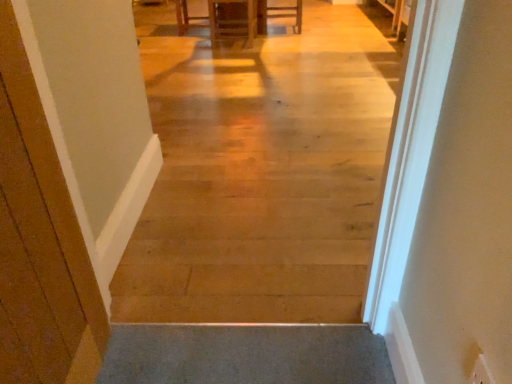
Question: Does matte wood cabinet at center, the first furniture positioned from the left, have a lesser width compared to matte wooden chair at center, marked as the 2th furniture in a left-to-right arrangement?

Choices:
 (A) no
 (B) yes

Answer: (A)

Question: Is matte wooden chair at center, positioned as the first furniture in right-to-left order, completely or partially inside matte wood cabinet at center, the first furniture in the front-to-back sequence?

Choices:
 (A) no
 (B) yes

Answer: (A)

Question: Considering the relative sizes of matte wood cabinet at center, the first furniture positioned from the left, and matte wooden chair at center, marked as the 2th furniture in a left-to-right arrangement, in the image provided, is matte wood cabinet at center, the first furniture positioned from the left, shorter than matte wooden chair at center, marked as the 2th furniture in a left-to-right arrangement,?

Choices:
 (A) no
 (B) yes

Answer: (A)

Question: From a real-world perspective, is matte wood cabinet at center, the 2th furniture from the back, beneath matte wooden chair at center, which is the 1th furniture from back to front?

Choices:
 (A) yes
 (B) no

Answer: (B)

Question: From a real-world perspective, does matte wood cabinet at center, the first furniture positioned from the left, stand above matte wooden chair at center, which is the 1th furniture from back to front?

Choices:
 (A) yes
 (B) no

Answer: (A)

Question: Is wooden table at center inside the boundaries of matte wooden chair at center, which is counted as the 2th furniture, starting from the front, or outside?

Choices:
 (A) inside
 (B) outside

Answer: (B)

Question: Is point (180, 18) positioned closer to the camera than point (297, 1)?

Choices:
 (A) farther
 (B) closer

Answer: (A)

Question: From a real-world perspective, is wooden table at center positioned above or below matte wooden chair at center, marked as the 2th furniture in a left-to-right arrangement?

Choices:
 (A) below
 (B) above

Answer: (B)

Question: Looking at their shapes, would you say wooden table at center is wider or thinner than matte wooden chair at center, which is the 1th furniture from back to front?

Choices:
 (A) thin
 (B) wide

Answer: (B)

Question: Is point (270, 187) closer or farther from the camera than point (279, 16)?

Choices:
 (A) closer
 (B) farther

Answer: (A)

Question: From their relative heights in the image, would you say wooden floor at center is taller or shorter than matte wooden chair at center, which is the 1th furniture from back to front?

Choices:
 (A) short
 (B) tall

Answer: (B)

Question: Based on their positions, is wooden floor at center located to the left or right of matte wooden chair at center, marked as the 2th furniture in a left-to-right arrangement?

Choices:
 (A) left
 (B) right

Answer: (A)

Question: Based on their sizes in the image, would you say wooden floor at center is bigger or smaller than matte wooden chair at center, positioned as the first furniture in right-to-left order?

Choices:
 (A) big
 (B) small

Answer: (A)

Question: From a real-world perspective, is matte wooden chair at center, which is counted as the 2th furniture, starting from the front, physically located above or below wooden table at center?

Choices:
 (A) above
 (B) below

Answer: (B)

Question: Based on their positions, is matte wooden chair at center, which is counted as the 2th furniture, starting from the front, located to the left or right of wooden table at center?

Choices:
 (A) left
 (B) right

Answer: (B)